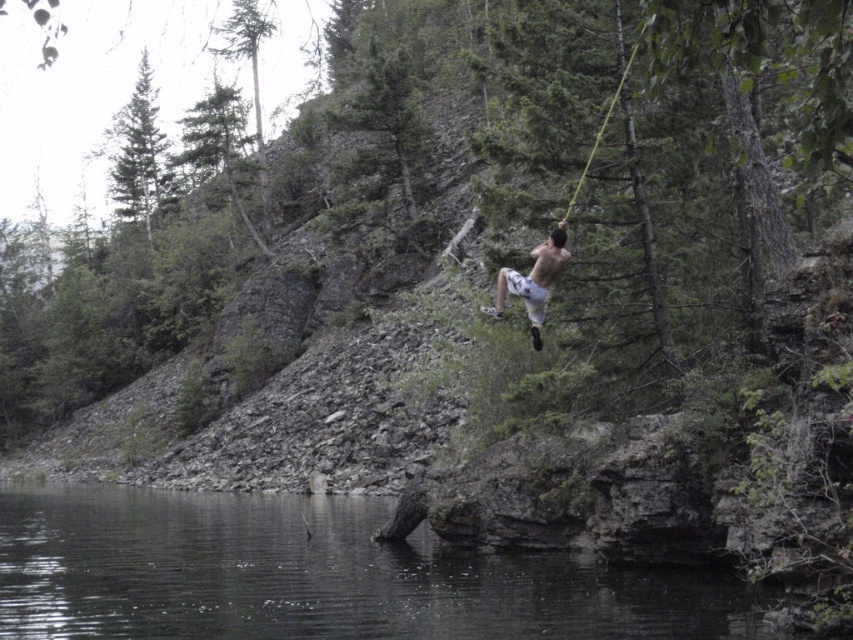
Who is positioned more to the left, transparent water at lower center or white cotton shorts at center?

Positioned to the left is transparent water at lower center.

Between transparent water at lower center and white cotton shorts at center, which one appears on the right side from the viewer's perspective?

white cotton shorts at center is more to the right.

Who is more forward, (80, 608) or (543, 308)?

Positioned in front is point (543, 308).

What are the coordinates of `transparent water at lower center` in the screenshot? It's located at (312, 577).